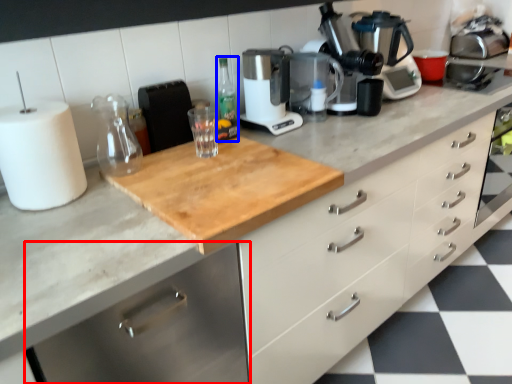
Question: Among these objects, which one is farthest to the camera, cabinetry (highlighted by a red box) or bottle (highlighted by a blue box)?

Choices:
 (A) cabinetry
 (B) bottle

Answer: (B)